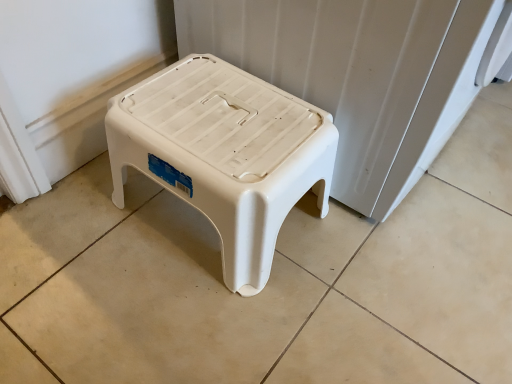
The width and height of the screenshot is (512, 384). I want to click on white plastic stool at center, so click(224, 154).

What is the approximate width of white plastic stool at center?

It is 36.21 centimeters.

This screenshot has width=512, height=384. Describe the element at coordinates (224, 154) in the screenshot. I see `white plastic stool at center` at that location.

This screenshot has width=512, height=384. Find the location of `white plastic stool at center`. white plastic stool at center is located at coordinates (224, 154).